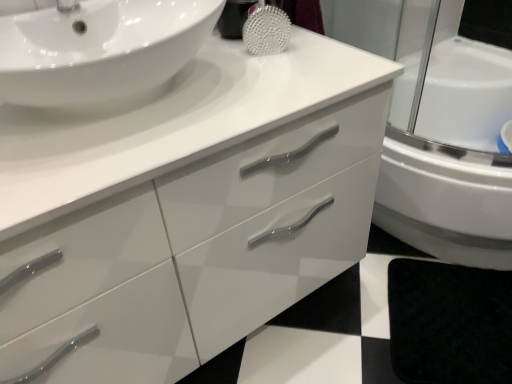
This screenshot has width=512, height=384. I want to click on free region under white glossy sink at upper left (from a real-world perspective), so click(126, 103).